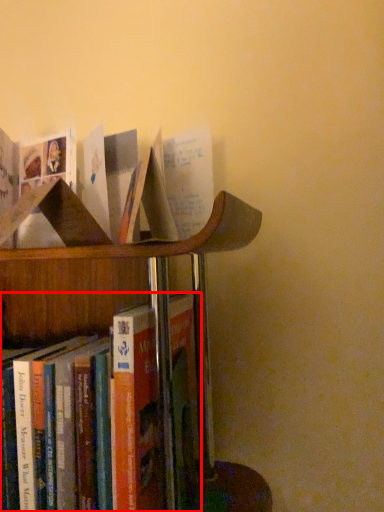
Question: Observing the image, what is the correct spatial positioning of book (annotated by the red box) in reference to book?

Choices:
 (A) left
 (B) right

Answer: (A)